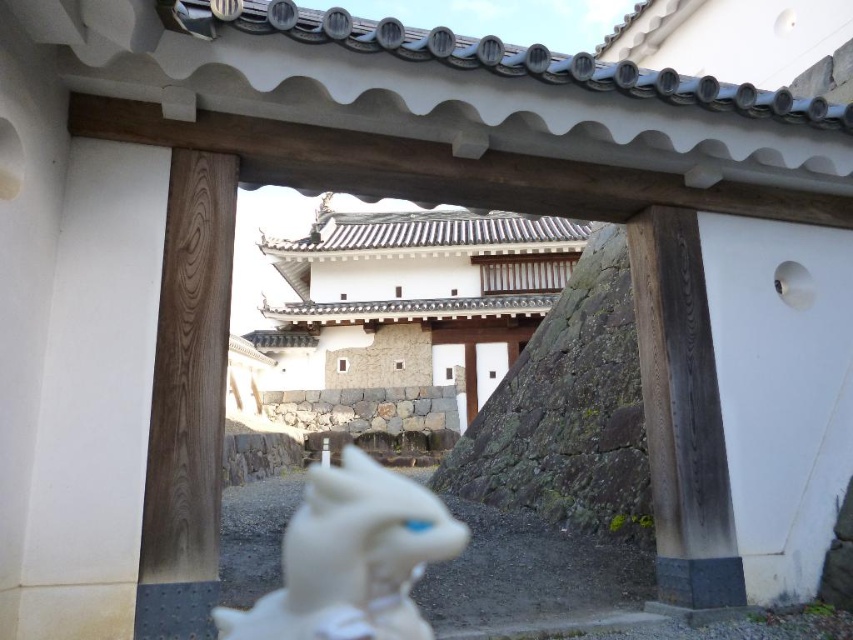
Question: Does white glossy statue at center appear under stone wall at center?

Choices:
 (A) yes
 (B) no

Answer: (B)

Question: Which point is farther from the camera taking this photo?

Choices:
 (A) (393, 637)
 (B) (456, 330)

Answer: (B)

Question: Observing the image, what is the correct spatial positioning of white glossy statue at center in reference to stone wall at center?

Choices:
 (A) left
 (B) right

Answer: (A)

Question: Which point is closer to the camera?

Choices:
 (A) white glossy statue at center
 (B) stone wall at center

Answer: (A)

Question: Can you confirm if white glossy statue at center is positioned below stone wall at center?

Choices:
 (A) no
 (B) yes

Answer: (A)